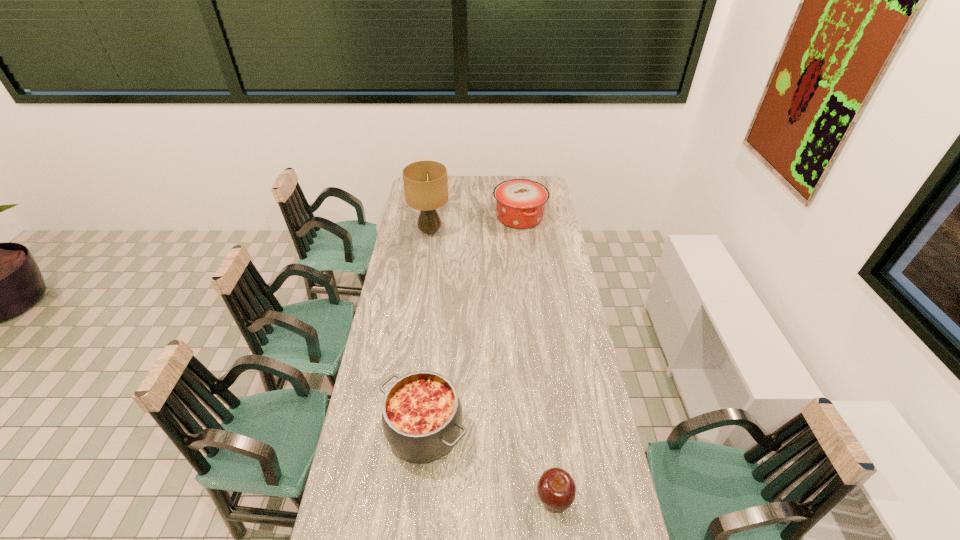
You are a GUI agent. You are given a task and a screenshot of the screen. Output one action in this format:
    pyautogui.click(x=<x>, y=<y>)
    Task: Click on the vacant point that satisfies the following two spatial constraints: 1. on the back side of the farther casserole; 2. on the right side of the lampshade
    
    Given the screenshot: What is the action you would take?
    pyautogui.click(x=432, y=217)